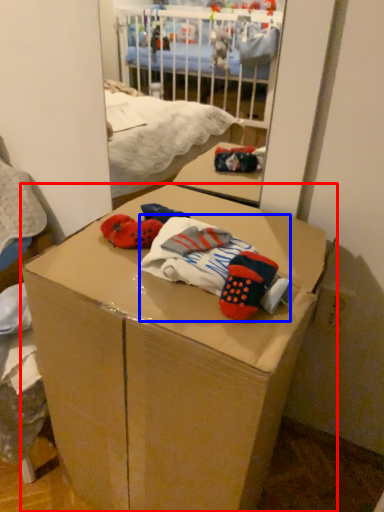
Question: Which object appears farthest to the camera in this image, box (highlighted by a red box) or baby clothe (highlighted by a blue box)?

Choices:
 (A) box
 (B) baby clothe

Answer: (B)